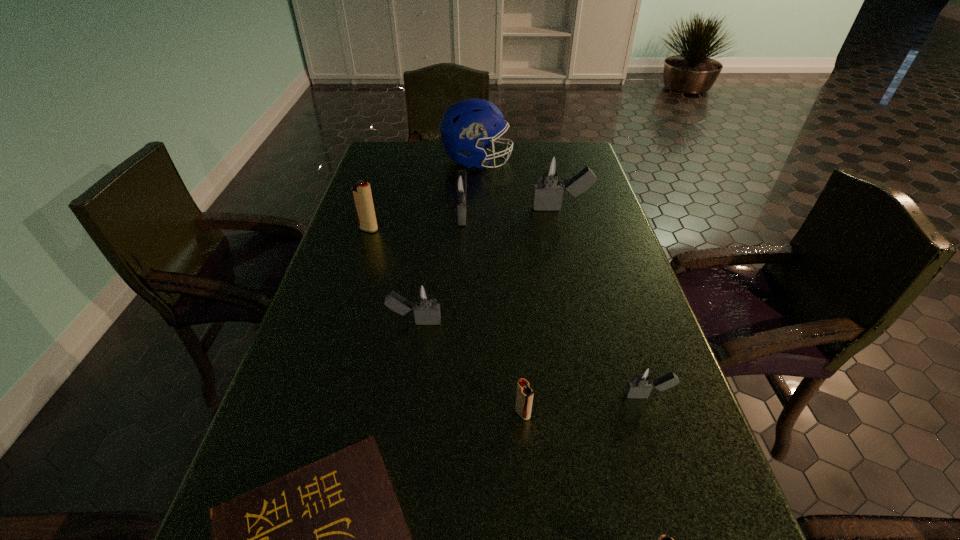
I want to click on football helmet, so click(465, 126).

In order to click on blue football helmet in this screenshot , I will do `click(465, 126)`.

Find the location of a particular element. the eighth shortest object is located at coordinates (551, 168).

The image size is (960, 540). Identify the location of the biggest gray igniter. (551, 168).

Locate an element on the screen. the biggest red igniter is located at coordinates (361, 193).

I want to click on the leftmost igniter, so click(361, 193).

I want to click on the third smallest gray igniter, so click(x=460, y=184).

The image size is (960, 540). Find the location of `the fifth nearest object`. the fifth nearest object is located at coordinates (424, 301).

Identify the location of the fourth nearest igniter. The image size is (960, 540). (424, 301).

The image size is (960, 540). I want to click on the smallest red igniter, so click(x=524, y=397).